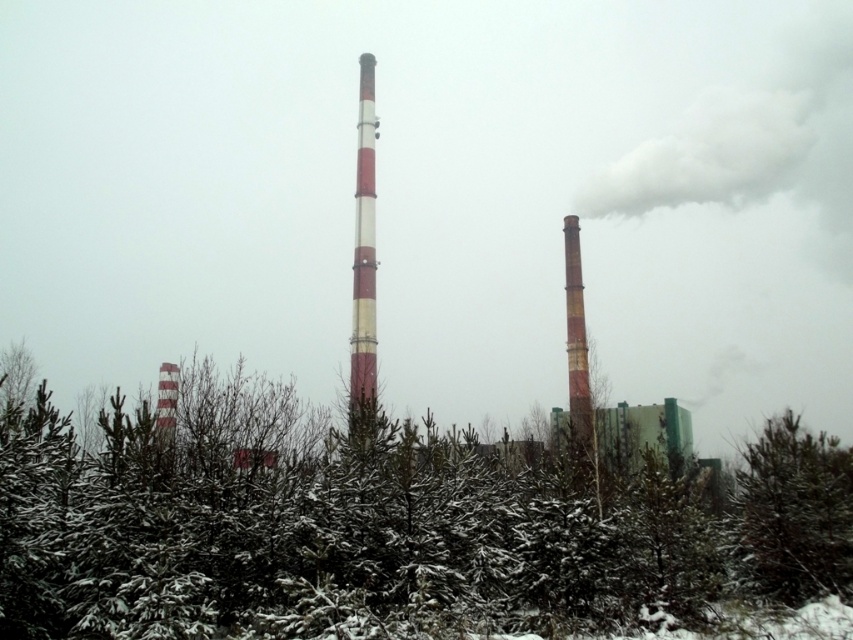
Does green matte tree at center appear on the left side of green matte tree at lower right?

Indeed, green matte tree at center is positioned on the left side of green matte tree at lower right.

Measure the distance between green matte tree at center and camera.

The distance of green matte tree at center from camera is 55.11 feet.

Does point (524, 477) lie behind point (846, 508)?

Yes, point (524, 477) is farther from viewer.

Where is `green matte tree at center`? This screenshot has height=640, width=853. green matte tree at center is located at coordinates (375, 528).

Is green matte tree at lower right further to camera compared to yellowish-brown textured chimney at right?

No, green matte tree at lower right is in front of yellowish-brown textured chimney at right.

What do you see at coordinates (791, 515) in the screenshot? The width and height of the screenshot is (853, 640). I see `green matte tree at lower right` at bounding box center [791, 515].

Locate an element on the screen. This screenshot has width=853, height=640. green matte tree at lower right is located at coordinates (791, 515).

Does green matte tree at center have a greater width compared to red and white striped pole at center?

Yes.

Who is shorter, green matte tree at center or red and white striped pole at center?

Result: green matte tree at center

Does point (218, 426) come behind point (360, 209)?

No, (218, 426) is in front of (360, 209).

You are a GUI agent. You are given a task and a screenshot of the screen. Output one action in this format:
    pyautogui.click(x=<x>, y=<y>)
    Task: Click on the green matte tree at center
    
    Given the screenshot: What is the action you would take?
    pyautogui.click(x=375, y=528)